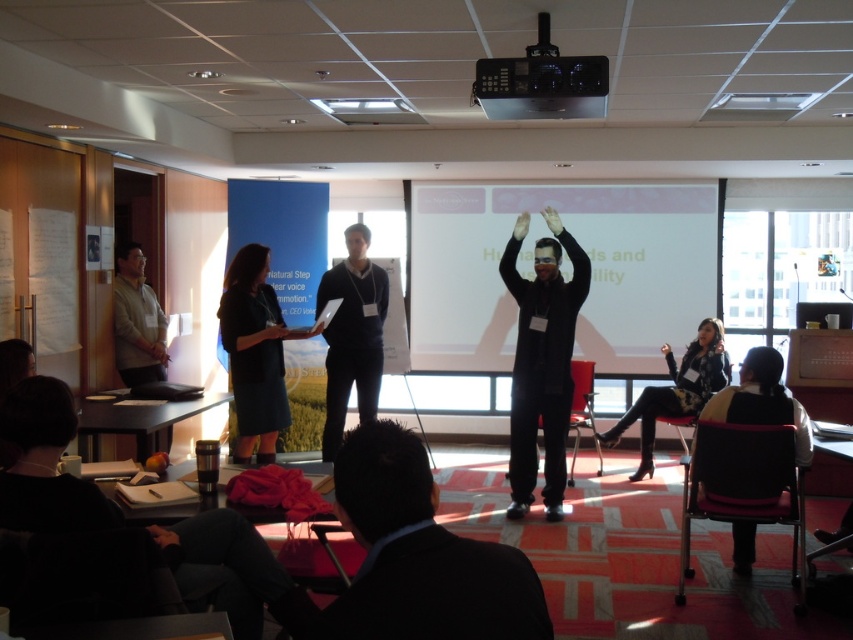
Question: In this image, where is dark blue dress at center located relative to velvet-like black chair at lower right?

Choices:
 (A) right
 (B) left

Answer: (B)

Question: Which object is farther from the camera taking this photo?

Choices:
 (A) light brown wood table at left
 (B) black matte suit at center

Answer: (A)

Question: Which point appears farthest from the camera in this image?

Choices:
 (A) (685, 424)
 (B) (242, 301)

Answer: (A)

Question: Does white matte projection screen at center lie behind black plastic projector at upper center?

Choices:
 (A) yes
 (B) no

Answer: (A)

Question: Which point is farther to the camera?

Choices:
 (A) (608, 356)
 (B) (547, 486)
 (C) (683, 408)
 (D) (561, 80)

Answer: (A)

Question: Can you confirm if black matte suit at center is positioned to the left of dark blue dress at center?

Choices:
 (A) no
 (B) yes

Answer: (A)